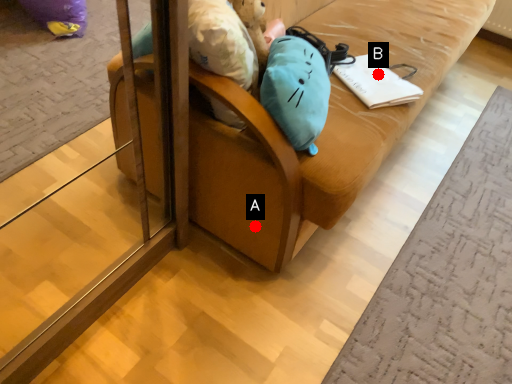
Question: Two points are circled on the image, labeled by A and B beside each circle. Among these points, which one is farthest from the camera?

Choices:
 (A) A is further
 (B) B is further

Answer: (B)